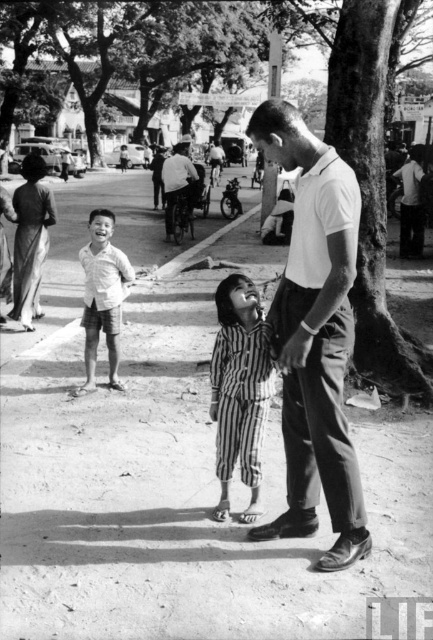
Based on the scene description, where exactly is the light beige cotton shirt at center located in the image?

The light beige cotton shirt at center is located at point coordinates of 0.464 on the x axis and 0.238 on the y axis.

You are a tailor observing a group of people in a black and white photo. You need to determine which shirt, the white smooth shirt at center or the light beige cotton shirt at center, requires more fabric to make based on their sizes. Which one would you choose?

The white smooth shirt at center has a larger size compared to the light beige cotton shirt at center, so it would require more fabric to make.